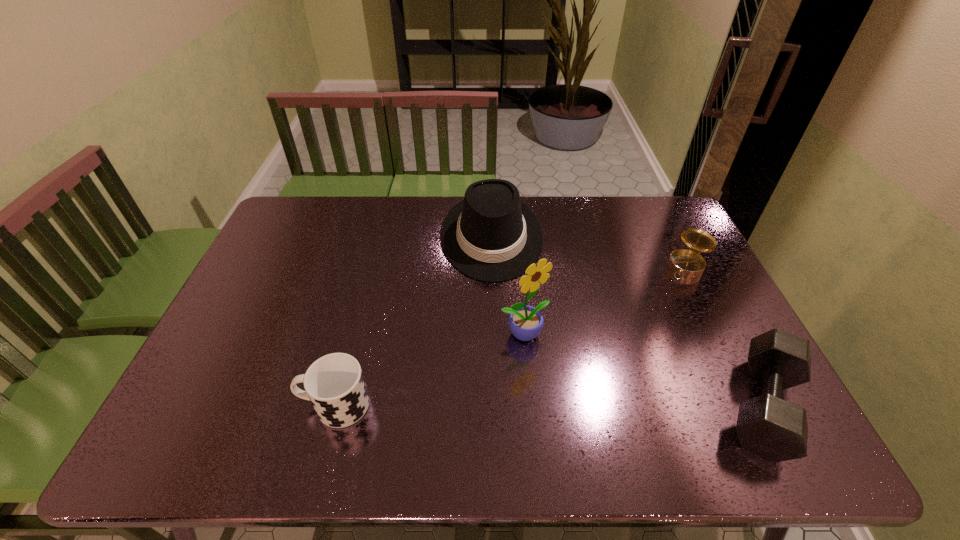
Find the location of a particular element. The height and width of the screenshot is (540, 960). vacant space situated 0.350m on the front-facing side of the second tallest object is located at coordinates [x=501, y=381].

At what (x,y) coordinates should I click in order to perform the action: click on free spot located on the front-facing side of the second tallest object. Please return your answer as a coordinate pair (x, y). Looking at the image, I should click on (497, 318).

Where is `blank space located 0.150m on the front-facing side of the second tallest object`? blank space located 0.150m on the front-facing side of the second tallest object is located at coordinates (497, 320).

The width and height of the screenshot is (960, 540). What are the coordinates of `free region located on the front-facing side of the sunflower` in the screenshot? It's located at (561, 369).

Where is `vacant space located 0.200m on the front-facing side of the sunflower`? This screenshot has width=960, height=540. vacant space located 0.200m on the front-facing side of the sunflower is located at coordinates (x=591, y=401).

You are a GUI agent. You are given a task and a screenshot of the screen. Output one action in this format:
    pyautogui.click(x=<x>, y=<y>)
    Task: Click on the blank space located on the front-facing side of the sunflower
    
    Given the screenshot: What is the action you would take?
    pyautogui.click(x=564, y=372)

Locate an element on the screen. vacant area located with the dial facing the compass is located at coordinates (667, 296).

Where is `free space located with the dial facing the compass`? free space located with the dial facing the compass is located at coordinates (653, 316).

What are the coordinates of `free space located 0.370m with the dial facing the compass` in the screenshot? It's located at (629, 353).

Image resolution: width=960 pixels, height=540 pixels. Find the location of `object that is at the far edge`. object that is at the far edge is located at coordinates (490, 235).